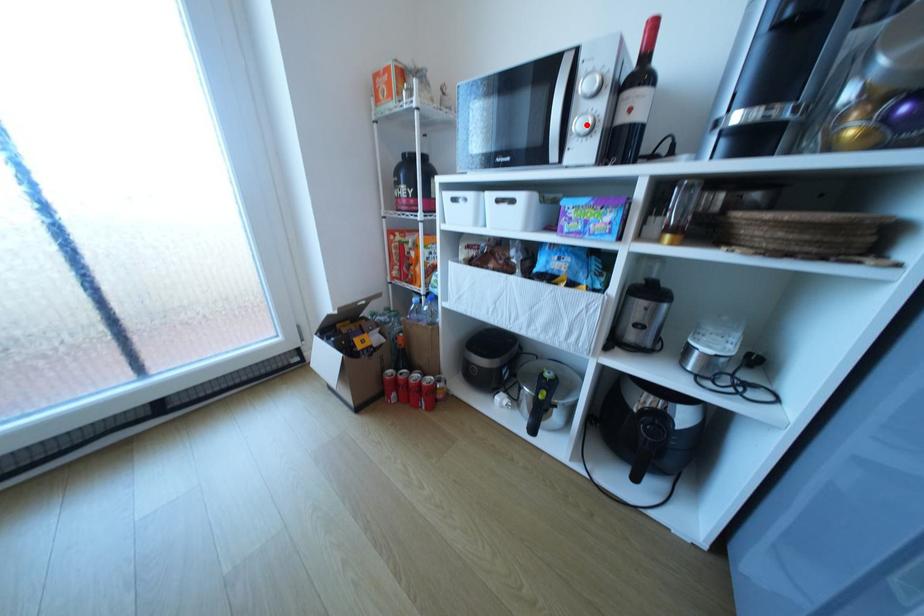
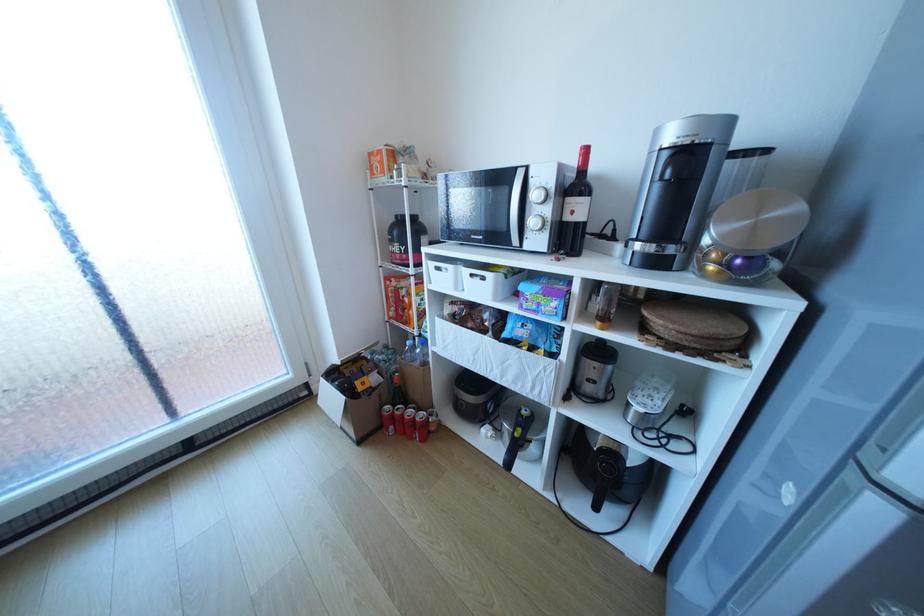
In the second image, find the point that corresponds to the highlighted location in the first image.

(541, 222)